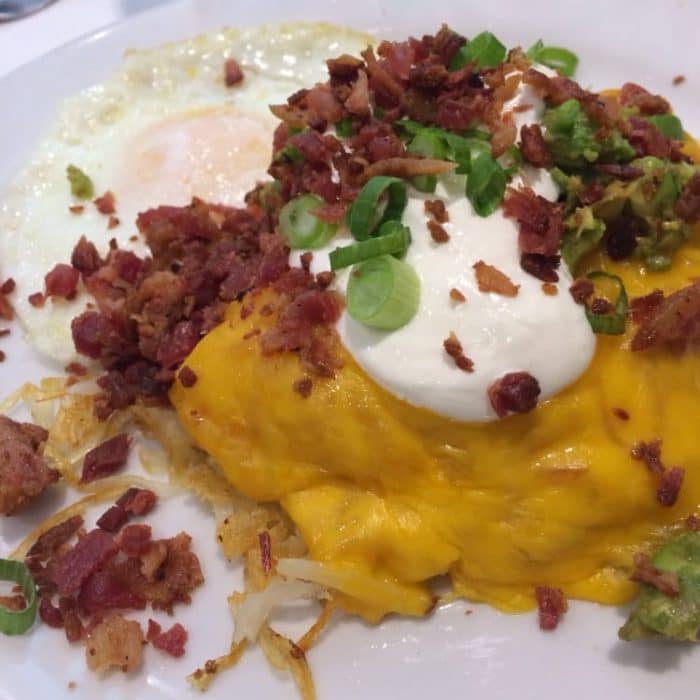
In order to click on crumb in this screenshot , I will do `click(675, 76)`.